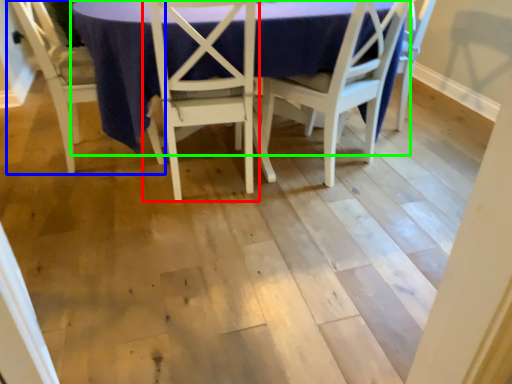
Question: Based on their relative distances, which object is farther from chair (highlighted by a red box)? Choose from chair (highlighted by a blue box) and round table (highlighted by a green box).

Choices:
 (A) chair
 (B) round table

Answer: (A)